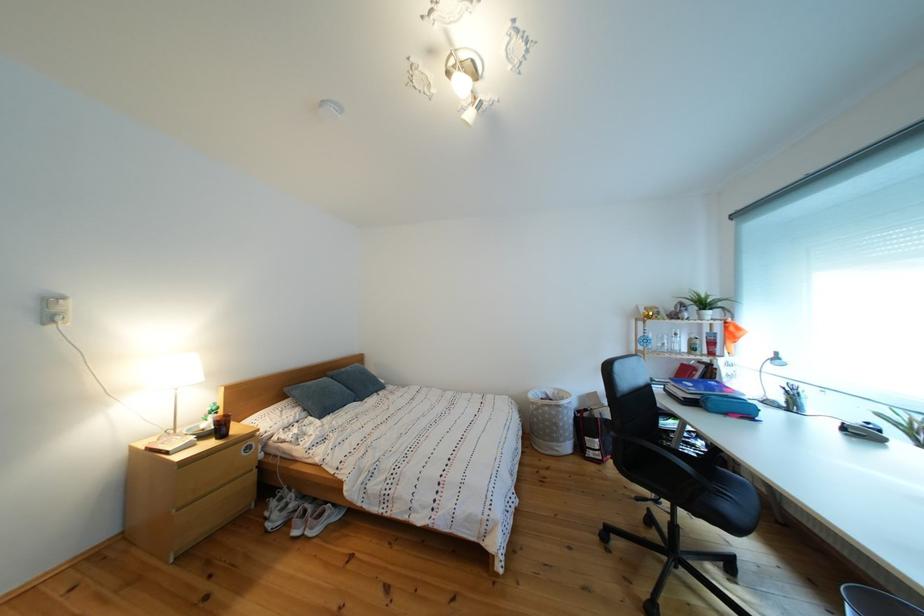
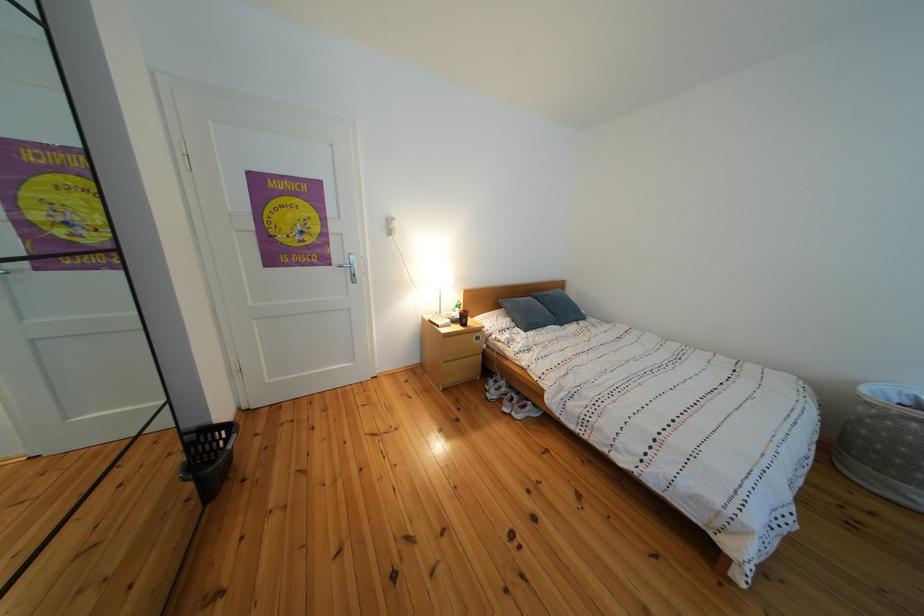
Where in the second image is the point corresponding to (x=545, y=400) from the first image?

(890, 398)